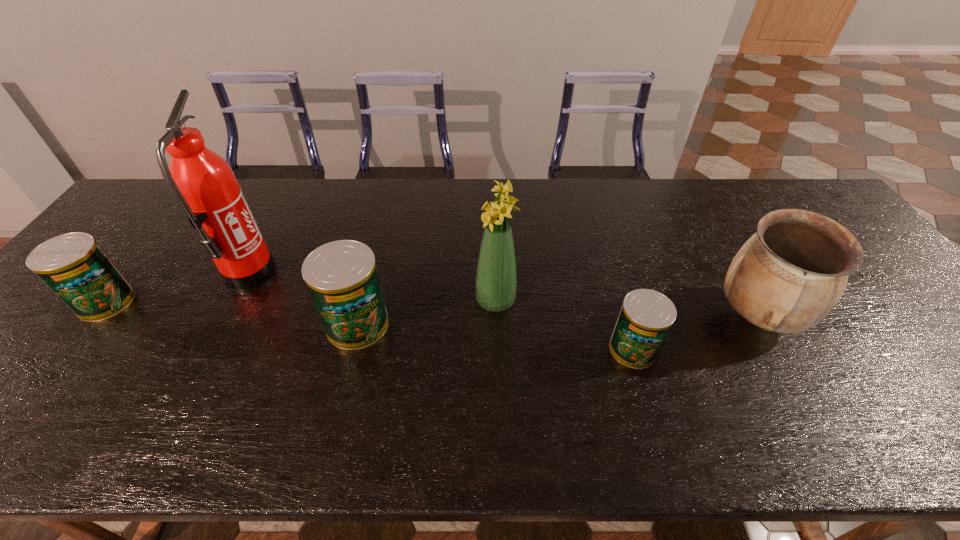
Please point a spot on the right to add another can. Please provide its 2D coordinates. Your answer should be formatted as a tuple, i.e. [(x, y)], where the tuple contains the x and y coordinates of a point satisfying the conditions above.

[(936, 376)]